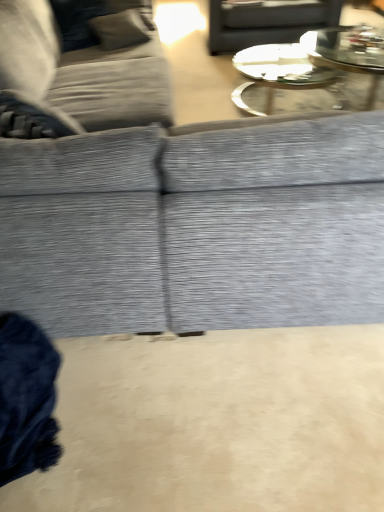
Question: Is textured gray couch at upper left, which ranks as the first studio couch in left-to-right order, behind clear glass coffee table at upper center?

Choices:
 (A) yes
 (B) no

Answer: (B)

Question: From the image's perspective, is textured gray couch at upper left, which is counted as the 2th studio couch, starting from the right, located above clear glass coffee table at upper center?

Choices:
 (A) no
 (B) yes

Answer: (A)

Question: Does textured gray couch at upper left, which is counted as the 2th studio couch, starting from the right, appear on the left side of clear glass coffee table at upper center?

Choices:
 (A) no
 (B) yes

Answer: (B)

Question: Is textured gray couch at upper left, which is counted as the 2th studio couch, starting from the right, closer to the viewer compared to clear glass coffee table at upper center?

Choices:
 (A) no
 (B) yes

Answer: (B)

Question: Is textured gray couch at upper left, which ranks as the first studio couch in left-to-right order, smaller than clear glass coffee table at upper center?

Choices:
 (A) yes
 (B) no

Answer: (B)

Question: Considering the relative sizes of textured gray couch at upper left, which ranks as the first studio couch in left-to-right order, and clear glass coffee table at upper center in the image provided, is textured gray couch at upper left, which ranks as the first studio couch in left-to-right order, bigger than clear glass coffee table at upper center?

Choices:
 (A) no
 (B) yes

Answer: (B)

Question: Is matte gray tray at upper center touching textured gray fabric couch at center, which is the second studio couch from left to right?

Choices:
 (A) no
 (B) yes

Answer: (A)

Question: Does matte gray tray at upper center have a larger size compared to textured gray fabric couch at center, positioned as the 1th studio couch in right-to-left order?

Choices:
 (A) yes
 (B) no

Answer: (B)

Question: Can you confirm if matte gray tray at upper center is shorter than textured gray fabric couch at center, positioned as the 1th studio couch in right-to-left order?

Choices:
 (A) yes
 (B) no

Answer: (A)

Question: From a real-world perspective, is matte gray tray at upper center over textured gray fabric couch at center, positioned as the 1th studio couch in right-to-left order?

Choices:
 (A) yes
 (B) no

Answer: (B)

Question: Considering the relative sizes of matte gray tray at upper center and textured gray fabric couch at center, which is the second studio couch from left to right, in the image provided, is matte gray tray at upper center smaller than textured gray fabric couch at center, which is the second studio couch from left to right,?

Choices:
 (A) no
 (B) yes

Answer: (B)

Question: Is matte gray tray at upper center positioned before textured gray fabric couch at center, positioned as the 1th studio couch in right-to-left order?

Choices:
 (A) yes
 (B) no

Answer: (B)

Question: From a real-world perspective, does clear glass coffee table at upper center sit lower than textured gray fabric couch at center, positioned as the 1th studio couch in right-to-left order?

Choices:
 (A) no
 (B) yes

Answer: (B)